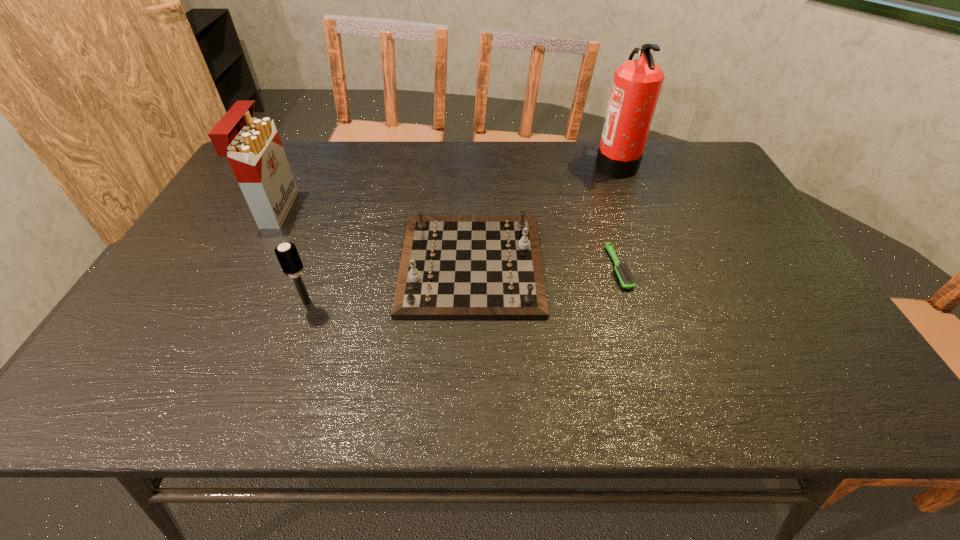
I want to click on the tallest object, so click(637, 83).

Find the location of a particular element. the farthest object is located at coordinates (637, 83).

Image resolution: width=960 pixels, height=540 pixels. In order to click on cigarette case in this screenshot , I will do `click(252, 145)`.

You are a GUI agent. You are given a task and a screenshot of the screen. Output one action in this format:
    pyautogui.click(x=<x>, y=<y>)
    Task: Click on the leftmost object
    
    Given the screenshot: What is the action you would take?
    pyautogui.click(x=252, y=145)

The image size is (960, 540). What are the coordinates of `the left hairbrush` in the screenshot? It's located at (287, 254).

This screenshot has height=540, width=960. Identify the location of the fourth object from right to left. (287, 254).

Locate an element on the screen. The width and height of the screenshot is (960, 540). the third object from right to left is located at coordinates (452, 267).

The height and width of the screenshot is (540, 960). I want to click on chessboard, so click(452, 267).

Identify the location of the shorter hairbrush. (627, 280).

This screenshot has height=540, width=960. I want to click on the farther hairbrush, so click(x=627, y=280).